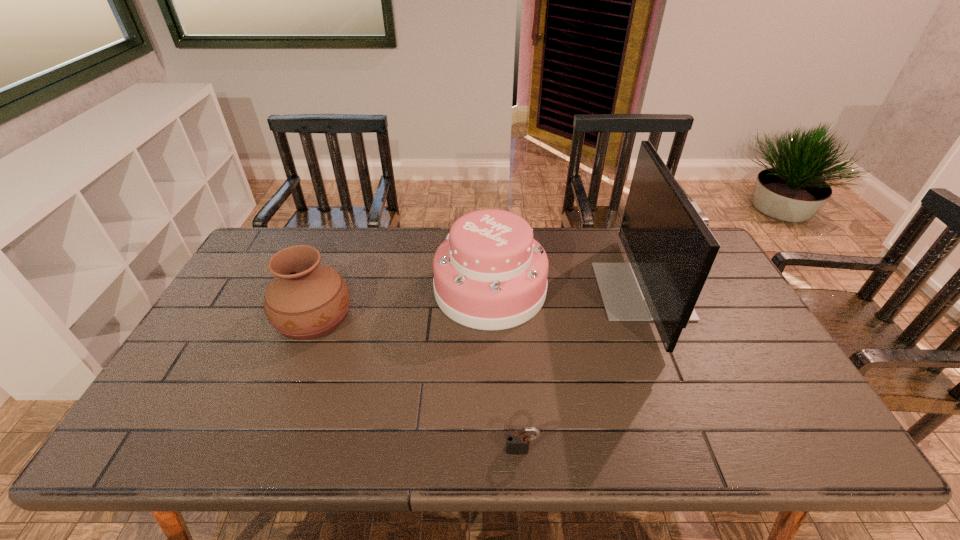
Find the location of a particular element. blank space located 0.140m on the back of the urn is located at coordinates (335, 261).

Where is `computer monitor at the far edge`? computer monitor at the far edge is located at coordinates (671, 250).

Locate an element on the screen. The height and width of the screenshot is (540, 960). cake that is at the far edge is located at coordinates pyautogui.click(x=489, y=273).

At what (x,y) coordinates should I click in order to perform the action: click on object that is at the near edge. Please return your answer as a coordinate pair (x, y). Looking at the image, I should click on (517, 444).

I want to click on object present at the right edge, so click(671, 250).

Identify the location of object that is at the far right corner. (671, 250).

Image resolution: width=960 pixels, height=540 pixels. In order to click on free space at the far edge in this screenshot , I will do `click(537, 238)`.

Where is `free space at the near edge of the desktop`? free space at the near edge of the desktop is located at coordinates (476, 430).

In order to click on vacant area at the left edge of the desktop in this screenshot , I will do `click(210, 406)`.

At what (x,y) coordinates should I click in order to perform the action: click on blank area at the right edge. Please return your answer as a coordinate pair (x, y). Looking at the image, I should click on pyautogui.click(x=788, y=387).